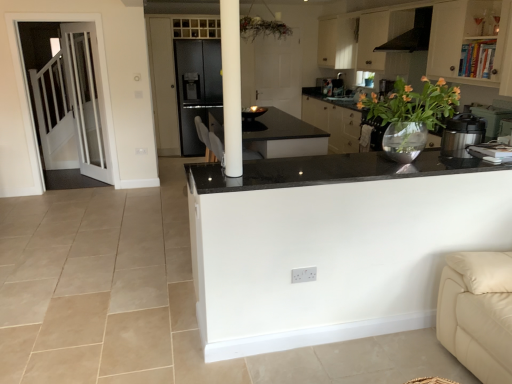
What is the approximate width of metallic silver pressure cooker at right?

It is 30.04 centimeters.

Locate an element on the screen. Image resolution: width=512 pixels, height=384 pixels. metallic silver pressure cooker at right is located at coordinates (461, 134).

Identify the location of black granite countertop at center. The height and width of the screenshot is (384, 512). (329, 171).

Measure the distance between point (433, 94) and camera.

The depth of point (433, 94) is 2.47 meters.

In order to face white glass door at left, should I rotate leftwards or rightwards?

A 21.121 degree turn to the left will do.

Find the location of a particular element. metallic silver pressure cooker at right is located at coordinates (461, 134).

Between white glass door at left and black matte exhaust hood at upper right, which one has less height?

Standing shorter between the two is black matte exhaust hood at upper right.

From a real-world perspective, is white glass door at left physically below black matte exhaust hood at upper right?

Yes, from a real-world perspective, white glass door at left is beneath black matte exhaust hood at upper right.

Looking at this image, from the image's perspective, is white glass door at left above or below black matte exhaust hood at upper right?

white glass door at left is below black matte exhaust hood at upper right.

Which object is wider, white glass door at left or black matte exhaust hood at upper right?

black matte exhaust hood at upper right is wider.

Which of these two, white matte cabinet at upper right or translucent glass vase at upper right, is smaller?

With smaller size is translucent glass vase at upper right.

I want to click on cabinetry on the right side of translucent glass vase at upper right, so click(x=429, y=41).

Is white matte cabinet at upper right positioned with its back to translucent glass vase at upper right?

white matte cabinet at upper right does not have its back to translucent glass vase at upper right.

How many degrees apart are the facing directions of white matte cabinet at upper right and translucent glass vase at upper right?

92.4 degrees separate the facing orientations of white matte cabinet at upper right and translucent glass vase at upper right.

Is black matte exhaust hood at upper right positioned before white glass door at left?

Yes, black matte exhaust hood at upper right is in front of white glass door at left.

This screenshot has height=384, width=512. In order to click on exhaust hood on the right of the white glass door at left in this screenshot , I will do `click(412, 34)`.

From a real-world perspective, is black matte exhaust hood at upper right positioned over white glass door at left based on gravity?

Yes, from a real-world perspective, black matte exhaust hood at upper right is above white glass door at left.

Can we say black matte exhaust hood at upper right lies outside white glass door at left?

Yes, black matte exhaust hood at upper right is outside of white glass door at left.

Would you say metallic silver pressure cooker at right contains black granite countertop at center?

That's incorrect, black granite countertop at center is not inside metallic silver pressure cooker at right.

Locate an element on the screen. countertop located underneath the metallic silver pressure cooker at right (from a real-world perspective) is located at coordinates (329, 171).

From the image's perspective, is metallic silver pressure cooker at right under black granite countertop at center?

No.

Considering the relative sizes of metallic silver pressure cooker at right and black granite countertop at center in the image provided, is metallic silver pressure cooker at right bigger than black granite countertop at center?

Actually, metallic silver pressure cooker at right might be smaller than black granite countertop at center.

Consider the image. Can you confirm if black granite countertop at center is positioned to the right of metallic silver pressure cooker at right?

Incorrect, black granite countertop at center is not on the right side of metallic silver pressure cooker at right.

Is black granite countertop at center next to metallic silver pressure cooker at right?

There is a gap between black granite countertop at center and metallic silver pressure cooker at right.

Is black granite countertop at center inside or outside of metallic silver pressure cooker at right?

black granite countertop at center lies outside metallic silver pressure cooker at right.

From the picture: From the image's perspective, between black granite countertop at center and metallic silver pressure cooker at right, which one is located above?

metallic silver pressure cooker at right.

From the picture: Can you confirm if black granite countertop at center is smaller than translucent glass vase at upper right?

Yes, black granite countertop at center is smaller than translucent glass vase at upper right.

Based on their positions, is black granite countertop at center located to the left or right of translucent glass vase at upper right?

From the image, it's evident that black granite countertop at center is to the left of translucent glass vase at upper right.

Is the depth of black granite countertop at center greater than that of translucent glass vase at upper right?

No, it is in front of translucent glass vase at upper right.

Find the location of a particular element. countertop directly beneath the translucent glass vase at upper right (from a real-world perspective) is located at coordinates click(x=329, y=171).

From the image's perspective, would you say white glass door at left is positioned over metallic silver pressure cooker at right?

Indeed, from the image's perspective, white glass door at left is shown above metallic silver pressure cooker at right.

Considering the positions of points (83, 101) and (443, 129), is point (83, 101) farther from camera compared to point (443, 129)?

That is True.

Is white glass door at left oriented away from metallic silver pressure cooker at right?

No, white glass door at left is not facing away from metallic silver pressure cooker at right.

Based on the photo, which of these two, white glass door at left or metallic silver pressure cooker at right, stands shorter?

metallic silver pressure cooker at right.

There is a white glass door at left. Where is `exhaust hood above it (from a real-world perspective)`? Image resolution: width=512 pixels, height=384 pixels. exhaust hood above it (from a real-world perspective) is located at coordinates pyautogui.click(x=412, y=34).

What are the coordinates of `cabinetry lying on the right of translucent glass vase at upper right` in the screenshot? It's located at (429, 41).

Looking at the image, which one is located closer to white matte cabinet at upper right, white glass door at left or translucent glass vase at upper right?

translucent glass vase at upper right lies closer to white matte cabinet at upper right than the other object.

Considering their positions, is white matte cabinet at upper right positioned closer to translucent glass vase at upper right than black granite countertop at center?

Based on the image, black granite countertop at center appears to be nearer to translucent glass vase at upper right.

Looking at the image, which one is located closer to black granite countertop at center, metallic silver pressure cooker at right or black matte exhaust hood at upper right?

metallic silver pressure cooker at right is positioned closer to the anchor black granite countertop at center.

From the image, which object appears to be nearer to white matte cabinet at upper right, translucent glass vase at upper right or metallic silver pressure cooker at right?

The object closer to white matte cabinet at upper right is metallic silver pressure cooker at right.

From the image, which object appears to be farther from white matte cabinet at upper right, white glass door at left or metallic silver pressure cooker at right?

white glass door at left is positioned further to the anchor white matte cabinet at upper right.

Looking at the image, which one is located further to white glass door at left, metallic silver pressure cooker at right or black granite countertop at center?

metallic silver pressure cooker at right is further to white glass door at left.

Looking at this image, from the image, which object appears to be farther from translucent glass vase at upper right, white glass door at left or white matte cabinet at upper right?

white glass door at left.

Looking at the image, which one is located closer to black matte exhaust hood at upper right, black granite countertop at center or translucent glass vase at upper right?

Based on the image, black granite countertop at center appears to be nearer to black matte exhaust hood at upper right.

Find the location of `kitchen appliance between translucent glass vase at upper right and black matte exhaust hood at upper right in the front-back direction`. kitchen appliance between translucent glass vase at upper right and black matte exhaust hood at upper right in the front-back direction is located at coordinates coord(461,134).

The width and height of the screenshot is (512, 384). In order to click on countertop located between white glass door at left and white matte cabinet at upper right in the left-right direction in this screenshot , I will do `click(329, 171)`.

You are a GUI agent. You are given a task and a screenshot of the screen. Output one action in this format:
    pyautogui.click(x=<x>, y=<y>)
    Task: Click on the cabinetry between black granite countertop at center and black matte exhaust hood at upper right along the z-axis
    
    Given the screenshot: What is the action you would take?
    pyautogui.click(x=429, y=41)

Find the location of `houseplant located between white glass door at left and white matte cabinet at upper right in the left-right direction`. houseplant located between white glass door at left and white matte cabinet at upper right in the left-right direction is located at coordinates (411, 115).